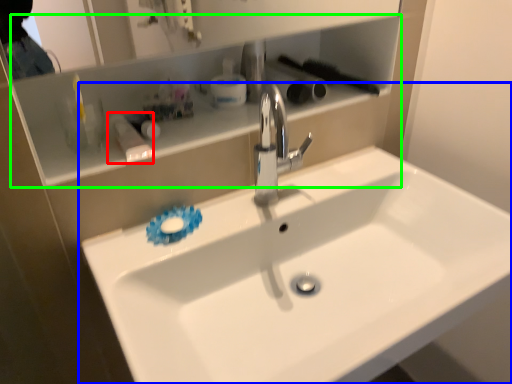
Question: Which object is positioned farthest from toiletry (highlighted by a red box)? Select from sink (highlighted by a blue box) and cabinet (highlighted by a green box).

Choices:
 (A) sink
 (B) cabinet

Answer: (A)